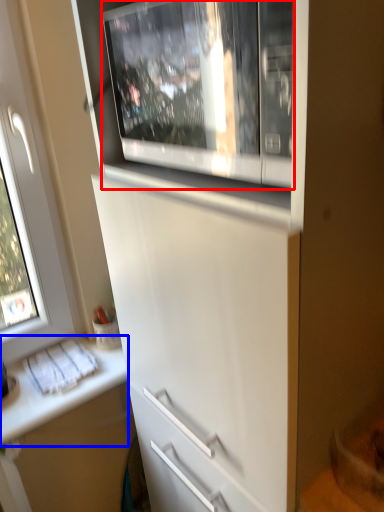
Question: Which point is further to the camera, home appliance (highlighted by a red box) or counter top (highlighted by a blue box)?

Choices:
 (A) home appliance
 (B) counter top

Answer: (B)